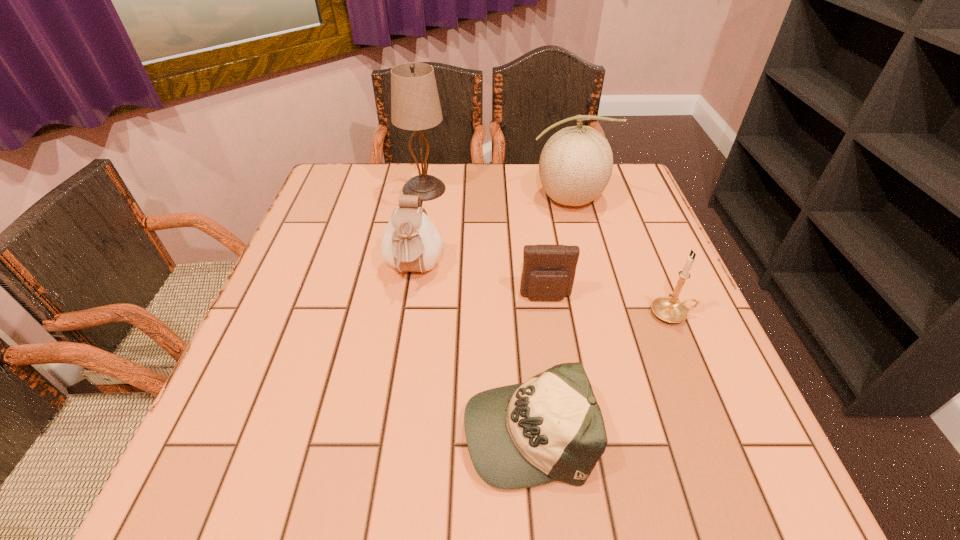
Where is `vacant space that's between the rightmost object and the shortest object`? This screenshot has height=540, width=960. vacant space that's between the rightmost object and the shortest object is located at coordinates (600, 372).

The height and width of the screenshot is (540, 960). What are the coordinates of `vacant space in between the taller pouch and the shortest object` in the screenshot? It's located at (470, 350).

This screenshot has height=540, width=960. In order to click on vacant area that lies between the cantaloup and the tallest object in this screenshot , I will do tap(495, 194).

The image size is (960, 540). Find the location of `free space that is in between the nearest object and the cantaloup`. free space that is in between the nearest object and the cantaloup is located at coordinates [x=547, y=314].

Select which object is the fifth closest to the tallest object. Please provide its 2D coordinates. Your answer should be formatted as a tuple, i.e. [(x, y)], where the tuple contains the x and y coordinates of a point satisfying the conditions above.

[(669, 309)]

At what (x,y) coordinates should I click in order to perform the action: click on the second closest object to the left pouch. Please return your answer as a coordinate pair (x, y). Image resolution: width=960 pixels, height=540 pixels. Looking at the image, I should click on [x=415, y=105].

Find the location of a particular element. The width and height of the screenshot is (960, 540). blank area in the image that satisfies the following two spatial constraints: 1. on the front-facing side of the lampshade; 2. on the right side of the cantaloup is located at coordinates (422, 200).

Identify the location of vacant point that satisfies the following two spatial constraints: 1. with an open flap on the right pouch; 2. on the front-facing side of the shortest object. (565, 429).